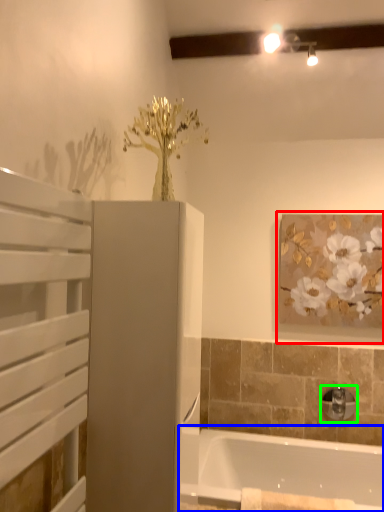
Question: Estimate the real-world distances between objects in this image. Which object is farther from picture frame (highlighted by a red box), bathtub (highlighted by a blue box) or tap (highlighted by a green box)?

Choices:
 (A) bathtub
 (B) tap

Answer: (A)